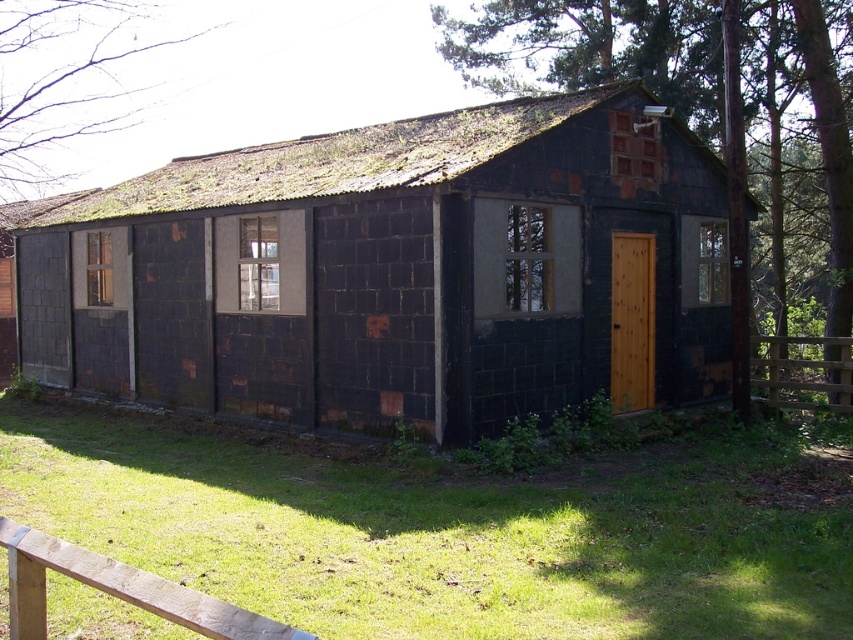
Consider the image. Can you confirm if green grass at lower left is smaller than rusty corrugated metal roof at upper center?

Yes.

Can you confirm if green grass at lower left is positioned to the right of rusty corrugated metal roof at upper center?

Correct, you'll find green grass at lower left to the right of rusty corrugated metal roof at upper center.

Who is more distant from viewer, (751,452) or (349,160)?

The point (349,160) is behind.

Where is `green grass at lower left`? Image resolution: width=853 pixels, height=640 pixels. green grass at lower left is located at coordinates (447, 531).

Measure the distance from rusty metal cabin at center to bare branches at upper left.

rusty metal cabin at center is 43.29 feet from bare branches at upper left.

The image size is (853, 640). What are the coordinates of `rusty metal cabin at center` in the screenshot? It's located at (398, 273).

Between rusty corrugated metal roof at upper center and wooden gate at right, which one has less height?

wooden gate at right is shorter.

Is point (260, 189) positioned before point (830, 406)?

Yes, it is in front of point (830, 406).

This screenshot has width=853, height=640. Identify the location of rusty corrugated metal roof at upper center. (338, 160).